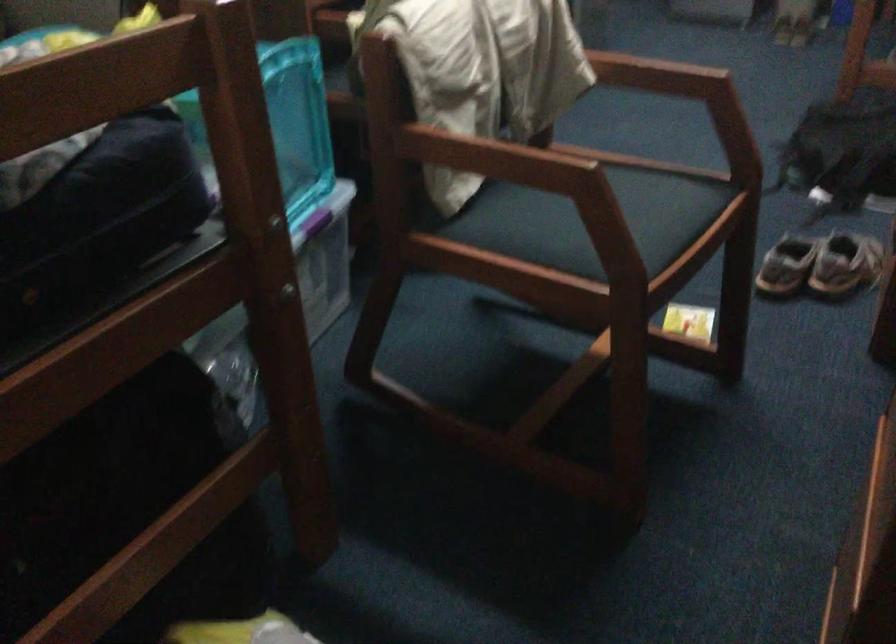
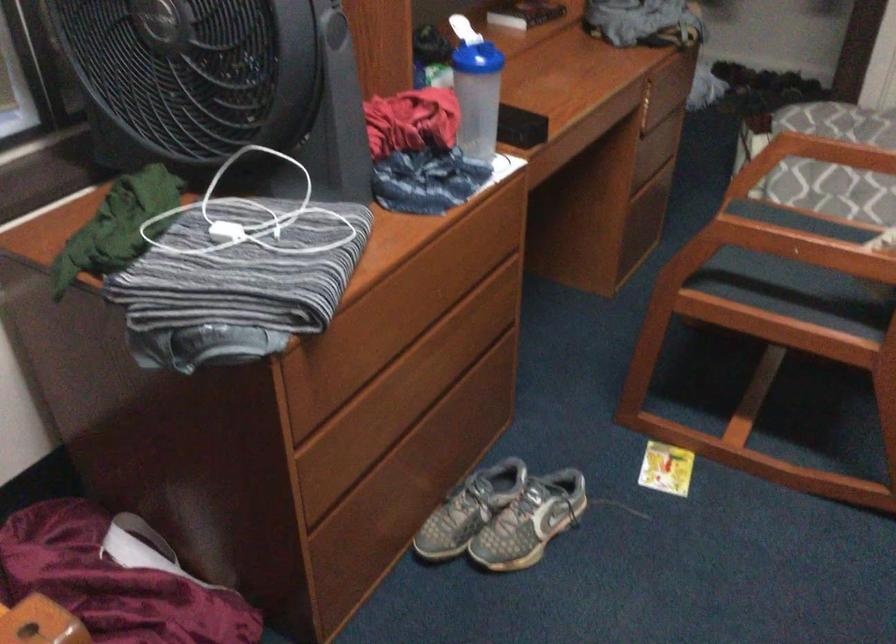
Locate, in the second image, the point that corresponds to point 656,82 in the first image.

(790, 245)